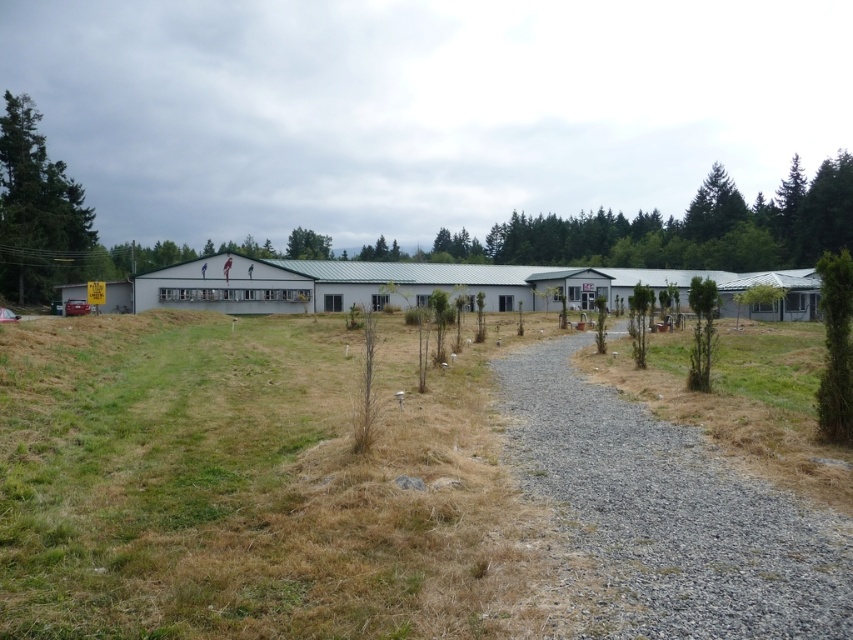
Question: Does gray gravel path at center appear under green textured tree at upper right?

Choices:
 (A) no
 (B) yes

Answer: (B)

Question: Is green textured tree at right below green leafy tree at center?

Choices:
 (A) no
 (B) yes

Answer: (B)

Question: Based on their relative distances, which object is farther from the green textured tree at left?

Choices:
 (A) brown dry grass at lower left
 (B) green leafy tree at center
 (C) green textured tree at right

Answer: (B)

Question: From the image, what is the correct spatial relationship of green textured tree at right in relation to green leafy tree at center?

Choices:
 (A) right
 (B) left

Answer: (A)

Question: Which point appears closest to the camera in this image?

Choices:
 (A) (699, 204)
 (B) (614, 604)
 (C) (830, 273)
 (D) (28, 186)

Answer: (B)

Question: Among these points, which one is farthest from the camera?

Choices:
 (A) (648, 518)
 (B) (712, 214)

Answer: (B)